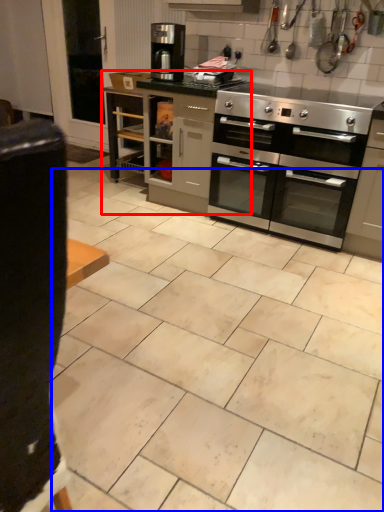
Question: Which object is closer to the camera taking this photo, cabinetry (highlighted by a red box) or ceramic tile (highlighted by a blue box)?

Choices:
 (A) cabinetry
 (B) ceramic tile

Answer: (B)